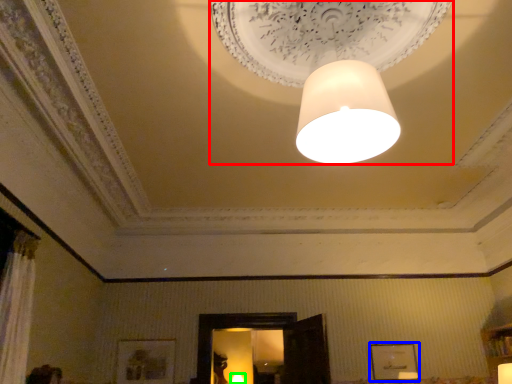
Question: Which is farther away from lamp (highlighted by a red box)? picture frame (highlighted by a blue box) or lamp (highlighted by a green box)?

Choices:
 (A) picture frame
 (B) lamp

Answer: (B)